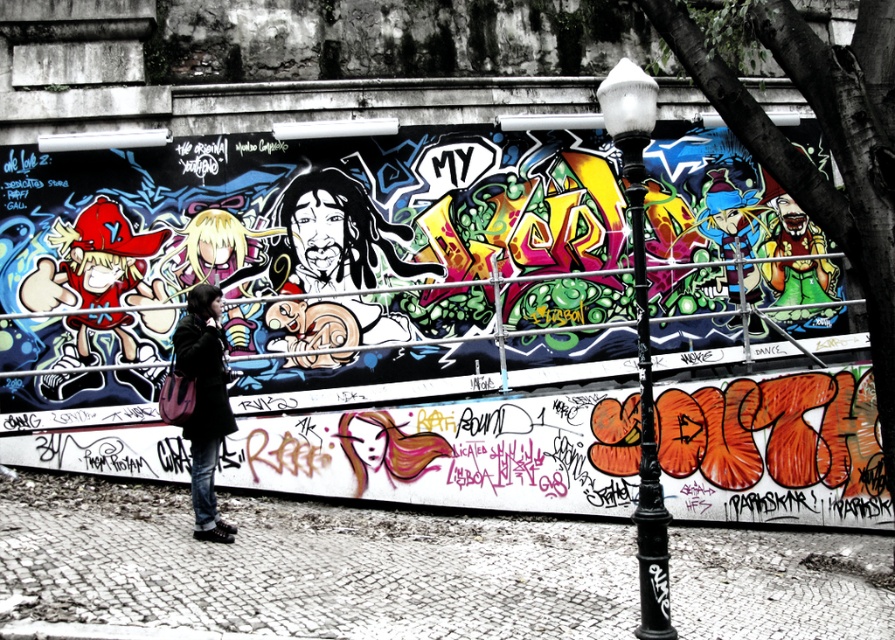
Does metal scaffolding at center have a greater height compared to dark blue denim jacket at lower left?

In fact, metal scaffolding at center may be shorter than dark blue denim jacket at lower left.

Is metal scaffolding at center closer to the viewer compared to dark blue denim jacket at lower left?

No.

At what (x,y) coordinates should I click in order to perform the action: click on metal scaffolding at center. Please return your answer as a coordinate pair (x, y). Looking at the image, I should click on (419, 339).

Where is `black metal lamp post at center`? The width and height of the screenshot is (895, 640). black metal lamp post at center is located at coordinates (641, 337).

Who is more distant from viewer, (644,141) or (197,294)?

Positioned behind is point (197,294).

The image size is (895, 640). What are the coordinates of `black metal lamp post at center` in the screenshot? It's located at (641, 337).

Is metal scaffolding at center smaller than black metal lamp post at center?

Yes.

Between metal scaffolding at center and black metal lamp post at center, which one appears on the left side from the viewer's perspective?

From the viewer's perspective, metal scaffolding at center appears more on the left side.

I want to click on metal scaffolding at center, so click(x=419, y=339).

Identify the location of metal scaffolding at center. (419, 339).